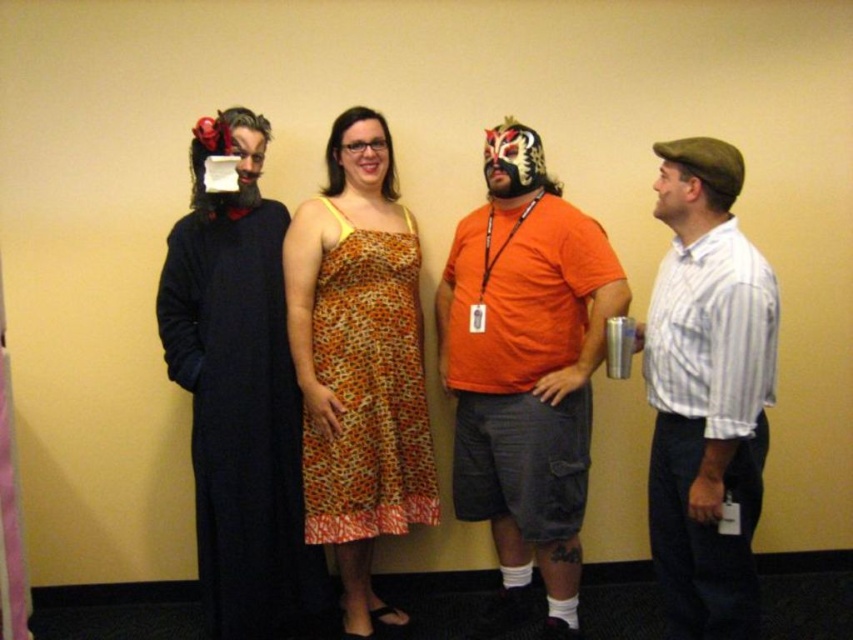
Question: Which of these objects is positioned closest to the white striped shirt at right?

Choices:
 (A) orange printed fabric dress at center
 (B) velvet black robe at left
 (C) orange cotton shirt at center

Answer: (C)

Question: Is orange cotton shirt at center to the right of orange printed fabric dress at center from the viewer's perspective?

Choices:
 (A) yes
 (B) no

Answer: (A)

Question: Which of the following is the closest to the observer?

Choices:
 (A) orange printed fabric dress at center
 (B) velvet black robe at left
 (C) orange cotton shirt at center
 (D) white striped shirt at right

Answer: (D)

Question: Can you confirm if orange cotton shirt at center is positioned to the left of orange printed fabric dress at center?

Choices:
 (A) yes
 (B) no

Answer: (B)

Question: Does orange cotton shirt at center have a lesser width compared to orange printed fabric dress at center?

Choices:
 (A) yes
 (B) no

Answer: (B)

Question: Which point is farther to the camera?

Choices:
 (A) (654, 147)
 (B) (602, 276)
 (C) (245, 550)

Answer: (C)